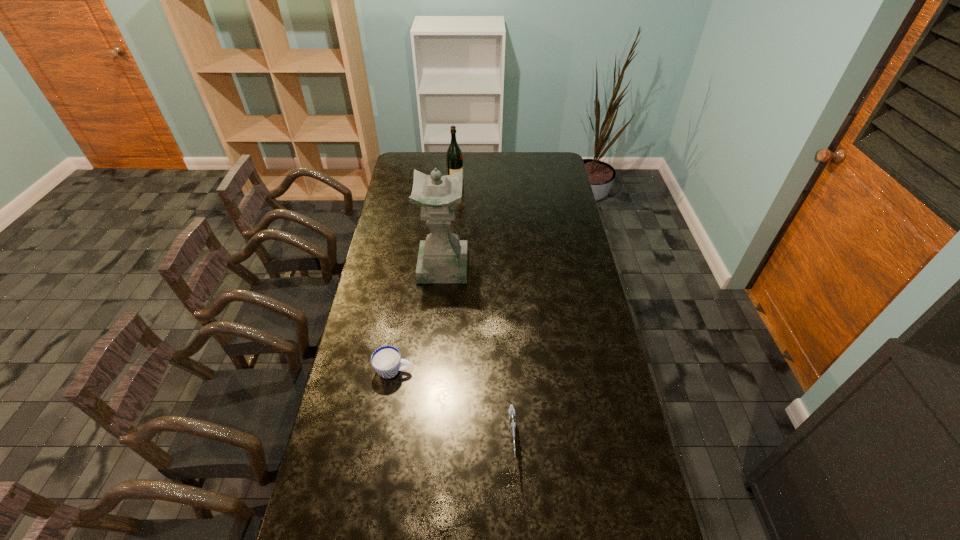
Where is `free space between the rightmost object and the second nearest object`? The height and width of the screenshot is (540, 960). free space between the rightmost object and the second nearest object is located at coordinates (453, 406).

You are a GUI agent. You are given a task and a screenshot of the screen. Output one action in this format:
    pyautogui.click(x=<x>, y=<y>)
    Task: Click on the blank region between the rightmost object and the third farthest object
    
    Given the screenshot: What is the action you would take?
    pyautogui.click(x=453, y=406)

The width and height of the screenshot is (960, 540). In order to click on unoccupied position between the nearest object and the second nearest object in this screenshot , I will do `click(453, 406)`.

Locate an element on the screen. free space between the second nearest object and the gun is located at coordinates (453, 406).

Locate which object is the third closest to the second farthest object. Please provide its 2D coordinates. Your answer should be formatted as a tuple, i.e. [(x, y)], where the tuple contains the x and y coordinates of a point satisfying the conditions above.

[(512, 418)]

Locate which object ranks third in proximity to the tallest object. Please provide its 2D coordinates. Your answer should be formatted as a tuple, i.e. [(x, y)], where the tuple contains the x and y coordinates of a point satisfying the conditions above.

[(512, 418)]

At what (x,y) coordinates should I click in order to perform the action: click on free space that satisfies the following two spatial constraints: 1. at the front opening of the tallest object; 2. on the side of the third farthest object with the handle. Please return your answer as a coordinate pair (x, y). Image resolution: width=960 pixels, height=540 pixels. Looking at the image, I should click on (434, 371).

This screenshot has width=960, height=540. I want to click on free space that satisfies the following two spatial constraints: 1. at the front opening of the sculpture; 2. on the side of the cup with the handle, so click(x=434, y=371).

You are a GUI agent. You are given a task and a screenshot of the screen. Output one action in this format:
    pyautogui.click(x=<x>, y=<y>)
    Task: Click on the free location that satisfies the following two spatial constraints: 1. at the front opening of the second farthest object; 2. on the side of the cup with the handle
    Image resolution: width=960 pixels, height=540 pixels.
    Given the screenshot: What is the action you would take?
    pyautogui.click(x=434, y=371)